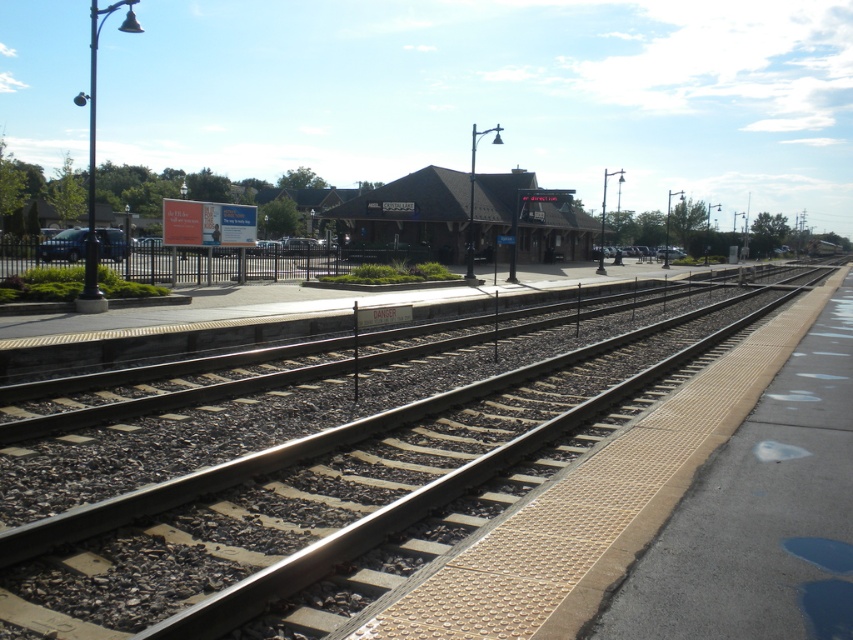
You are standing on the platform at the railway station. You see the smooth asphalt track at center and the brown wooden railway station at center. Which object is nearer to you?

The smooth asphalt track at center is closer to the viewer than the brown wooden railway station at center.

You are a maintenance worker needing to place a 1.2 meter tall safety barrier on the smooth asphalt track at center or the brown wooden railway station at center. Based on their heights, which location is suitable?

The smooth asphalt track at center has a lesser height compared to the brown wooden railway station at center. Therefore, the safety barrier should be placed on the brown wooden railway station at center since it can accommodate the height of the barrier better.

You are a maintenance worker standing on the platform at the railway station. You need to reach the smooth asphalt track at center for inspection. Can you safely walk directly to the track from your current position without stepping onto the tactile paving strip?

The smooth asphalt track at center is 3.68 meters away from you. Since the platform has a tactile paving strip along its edge, you must stay behind this strip for safety. Therefore, you cannot walk directly to the track without stepping onto the tactile paving strip, as the distance requires crossing the platform area which is separated by the strip.